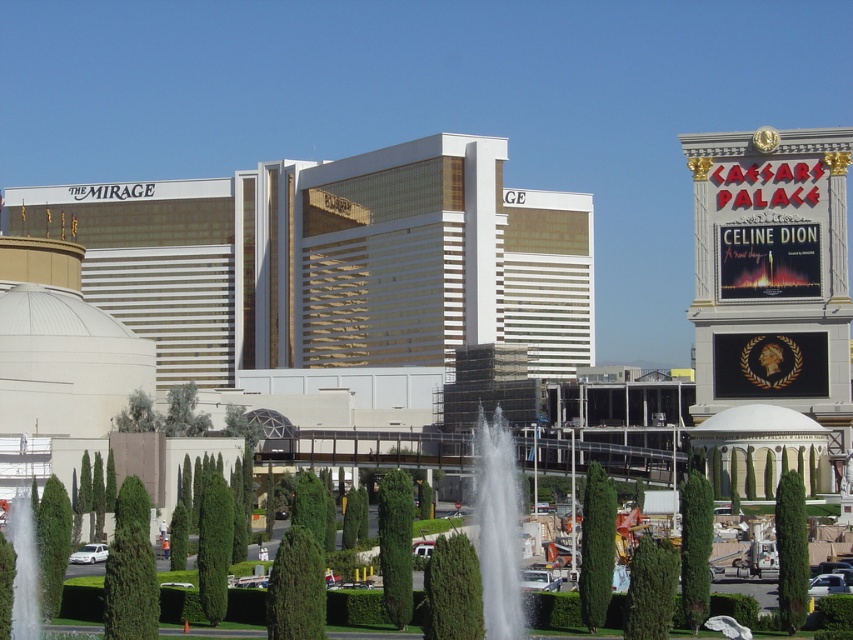
Question: Which point is closer to the camera taking this photo?

Choices:
 (A) (489, 474)
 (B) (350, 358)

Answer: (A)

Question: Does white glossy building at center appear under gold reflective building at center?

Choices:
 (A) yes
 (B) no

Answer: (A)

Question: Is gold reflective building at center positioned behind white water at center?

Choices:
 (A) yes
 (B) no

Answer: (A)

Question: Is gold reflective building at center positioned in front of white water at center?

Choices:
 (A) no
 (B) yes

Answer: (A)

Question: Which point is farther to the camera?

Choices:
 (A) white glossy building at center
 (B) gold reflective building at center
 (C) white water at center

Answer: (B)

Question: Which object is positioned closest to the gold reflective building at center?

Choices:
 (A) white water at center
 (B) white glossy building at center

Answer: (B)